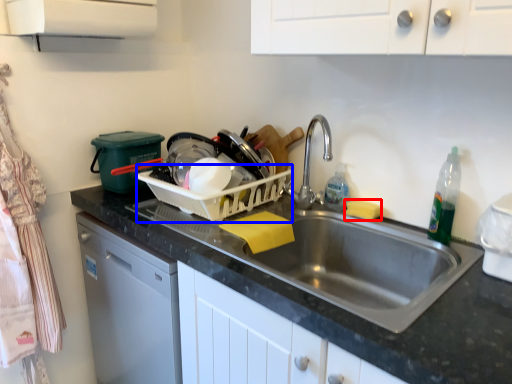
Question: Among these objects, which one is nearest to the camera, food (highlighted by a red box) or basket (highlighted by a blue box)?

Choices:
 (A) food
 (B) basket

Answer: (B)